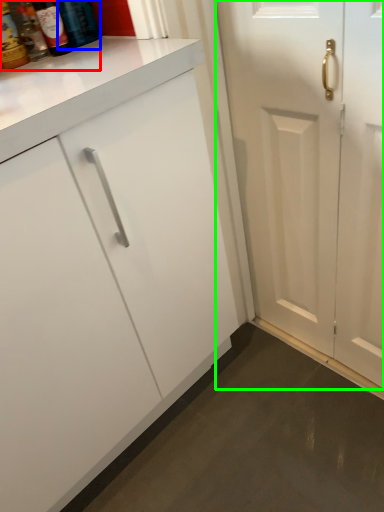
Question: Estimate the real-world distances between objects in this image. Which object is farther from bottle (highlighted by a red box), bottle (highlighted by a blue box) or door (highlighted by a green box)?

Choices:
 (A) bottle
 (B) door

Answer: (B)